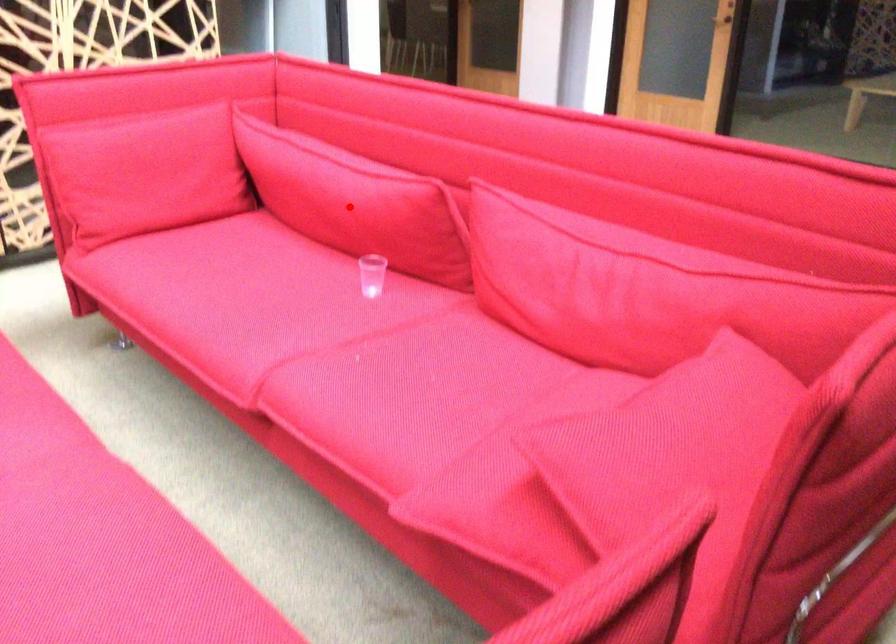
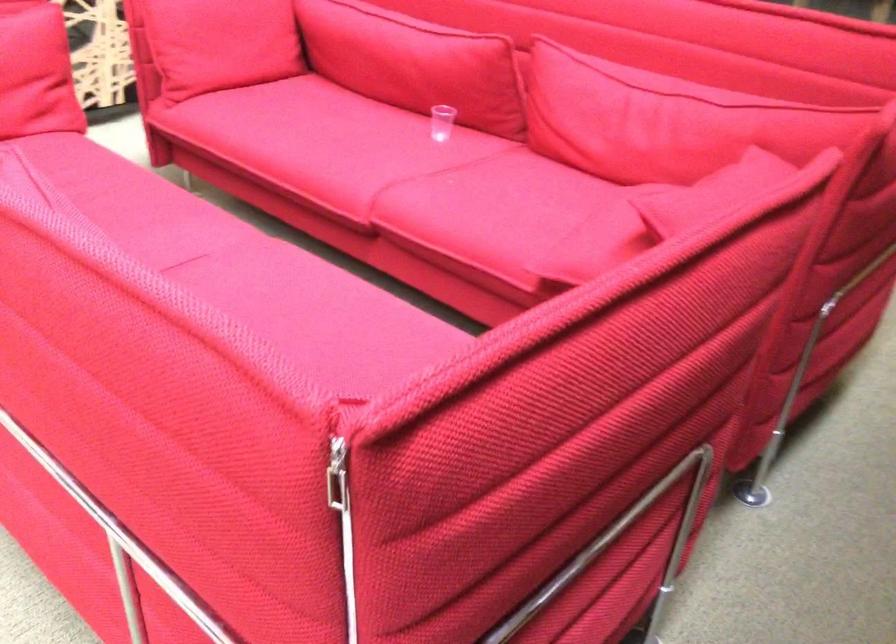
Find the pixel in the second image that matches the highlighted location in the first image.

(414, 62)